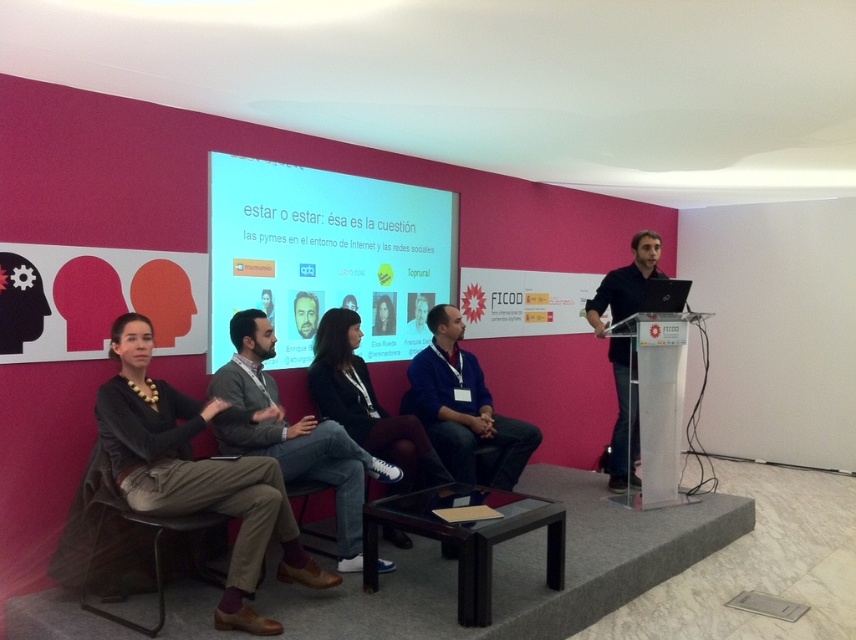
Question: Which point appears farthest from the camera in this image?

Choices:
 (A) (506, 436)
 (B) (614, 477)

Answer: (B)

Question: Does blue sweater at center have a smaller size compared to denim jacket at center?

Choices:
 (A) yes
 (B) no

Answer: (B)

Question: Does matte plastic screen at center have a larger size compared to dark gray sweater at left?

Choices:
 (A) no
 (B) yes

Answer: (B)

Question: Which of the following is the farthest from the observer?

Choices:
 (A) black plastic chair at lower left
 (B) dark gray sweater at left

Answer: (B)

Question: Which object is farther from the camera taking this photo?

Choices:
 (A) blue sweater at center
 (B) dark gray sweater at left
 (C) gray sweater at center
 (D) denim jacket at center

Answer: (A)

Question: Considering the relative positions of dark gray sweater at left and denim jacket at center in the image provided, where is dark gray sweater at left located with respect to denim jacket at center?

Choices:
 (A) right
 (B) left

Answer: (B)